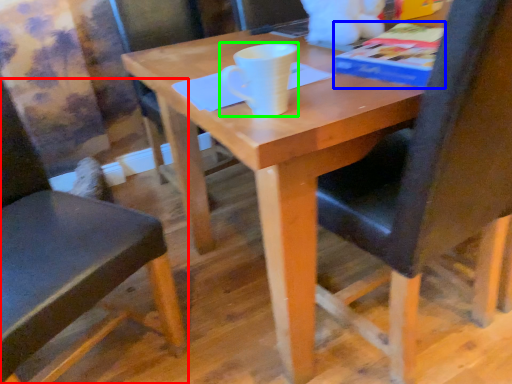
Question: Which object is positioned closest to chair (highlighted by a red box)? Select from paperback book (highlighted by a blue box) and coffee cup (highlighted by a green box).

Choices:
 (A) paperback book
 (B) coffee cup

Answer: (B)